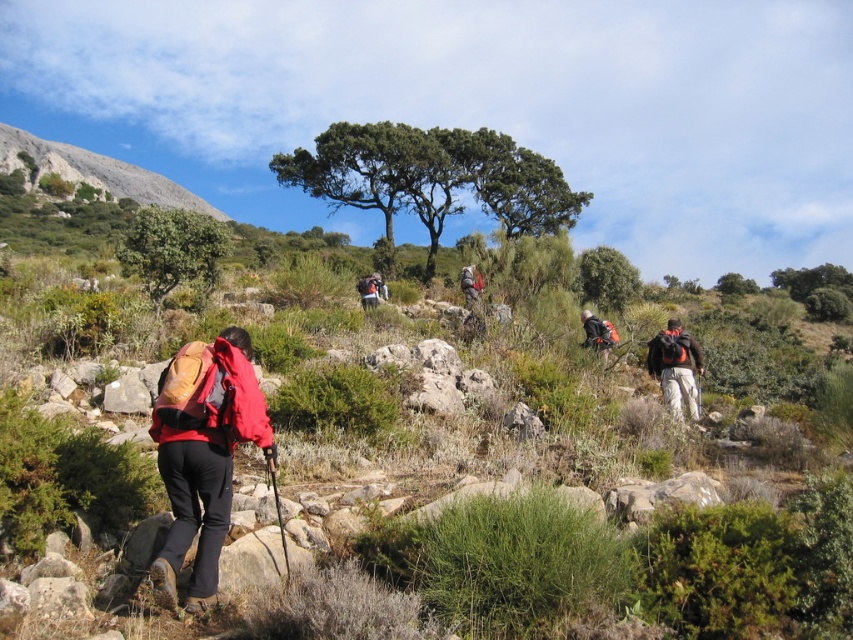
You are a hiker trying to identify your backpack. Both the matte red backpack at center and the matte gray backpack at center are in view. According to the scene, which backpack is covering the other one?

The matte red backpack at center is positioned over the matte gray backpack at center, so the matte red backpack is covering the matte gray one.

You are a hiker who needs to retrieve your matte black backpack at right and matte gray backpack at center. Given that you can carry both at once, how far apart are the two backpacks?

The distance between the matte black backpack at right and matte gray backpack at center is 7.98 meters.